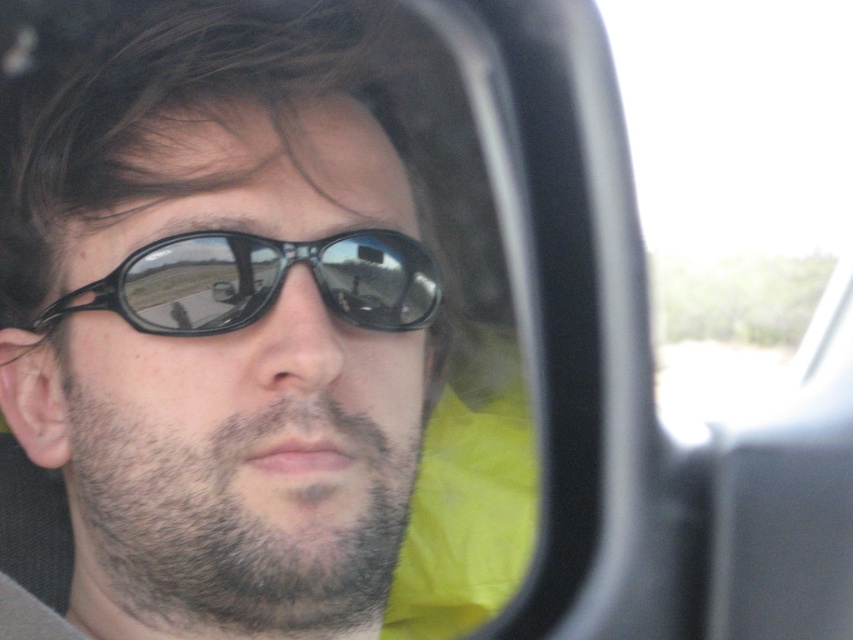
Between matte black sunglasses at center and transparent glass car window at upper right, which one has more height?

Standing taller between the two is transparent glass car window at upper right.

Which is above, matte black sunglasses at center or transparent glass car window at upper right?

transparent glass car window at upper right

Is point (345, 598) in front of point (722, 387)?

Yes, point (345, 598) is in front of point (722, 387).

Find the location of a particular element. Image resolution: width=853 pixels, height=640 pixels. matte black sunglasses at center is located at coordinates (259, 336).

Which is behind, point (651, 262) or point (125, 300)?

Point (651, 262)

Can you confirm if transparent glass car window at upper right is shorter than sunglasses at center?

Incorrect, transparent glass car window at upper right's height does not fall short of sunglasses at center's.

What do you see at coordinates (740, 188) in the screenshot? The height and width of the screenshot is (640, 853). I see `transparent glass car window at upper right` at bounding box center [740, 188].

Image resolution: width=853 pixels, height=640 pixels. I want to click on transparent glass car window at upper right, so click(740, 188).

Measure the distance from matte black sunglasses at center to sunglasses at center.

The distance of matte black sunglasses at center from sunglasses at center is 3.11 inches.

Locate an element on the screen. The height and width of the screenshot is (640, 853). matte black sunglasses at center is located at coordinates (259, 336).